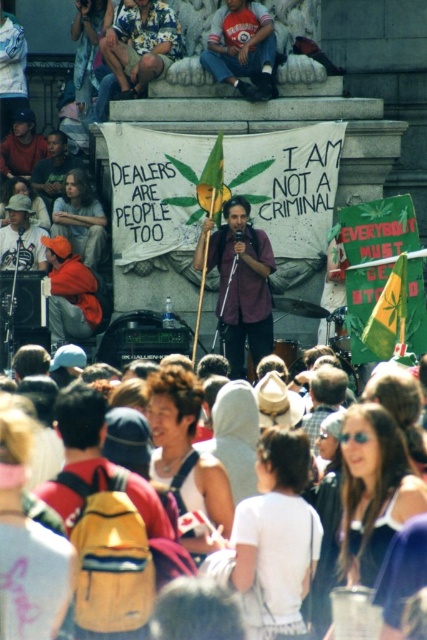
Question: Can you confirm if white cotton hoodie at center is bigger than matte purple shirt at center?

Choices:
 (A) yes
 (B) no

Answer: (A)

Question: Can you confirm if white cotton hoodie at center is positioned to the left of matte purple shirt at center?

Choices:
 (A) yes
 (B) no

Answer: (A)

Question: Among these objects, which one is nearest to the camera?

Choices:
 (A) denim jeans at upper center
 (B) matte purple shirt at center
 (C) white cotton hoodie at center

Answer: (C)

Question: Which object is closer to the camera taking this photo?

Choices:
 (A) white cotton hoodie at center
 (B) denim jeans at upper center
 (C) matte purple shirt at center

Answer: (A)

Question: From the image, what is the correct spatial relationship of white cotton hoodie at center in relation to matte purple shirt at center?

Choices:
 (A) left
 (B) right

Answer: (A)

Question: Among these objects, which one is nearest to the camera?

Choices:
 (A) matte purple shirt at center
 (B) white cotton hoodie at center
 (C) denim jeans at upper center

Answer: (B)